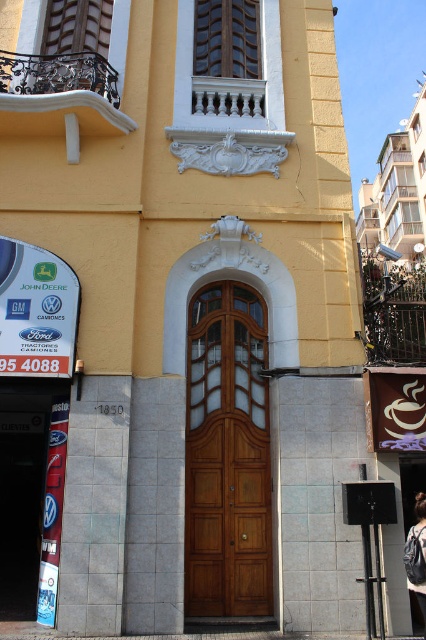
Question: Does wooden door at center have a larger size compared to denim jacket at lower right?

Choices:
 (A) no
 (B) yes

Answer: (B)

Question: Which of the following is the closest to the observer?

Choices:
 (A) wooden door at center
 (B) denim jacket at lower right

Answer: (B)

Question: Can you confirm if wooden door at center is wider than denim jacket at lower right?

Choices:
 (A) no
 (B) yes

Answer: (B)

Question: Which object is farther from the camera taking this photo?

Choices:
 (A) wooden door at center
 (B) denim jacket at lower right

Answer: (A)

Question: Is the position of wooden door at center less distant than that of denim jacket at lower right?

Choices:
 (A) yes
 (B) no

Answer: (B)